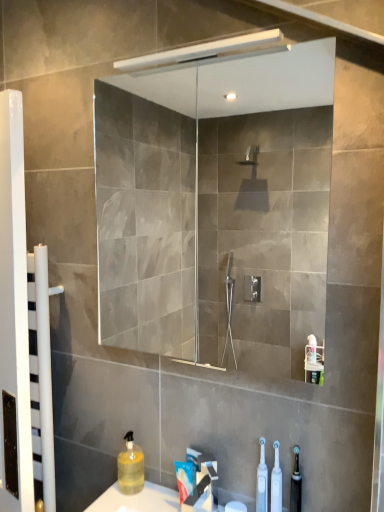
Question: Does transparent glass mirror at upper center have a larger size compared to white glossy towel rack at left?

Choices:
 (A) yes
 (B) no

Answer: (A)

Question: Can you confirm if transparent glass mirror at upper center is wider than white glossy towel rack at left?

Choices:
 (A) yes
 (B) no

Answer: (A)

Question: Is transparent glass mirror at upper center next to white glossy towel rack at left?

Choices:
 (A) yes
 (B) no

Answer: (B)

Question: Is transparent glass mirror at upper center positioned far away from white glossy towel rack at left?

Choices:
 (A) yes
 (B) no

Answer: (A)

Question: Can you confirm if transparent glass mirror at upper center is smaller than white glossy towel rack at left?

Choices:
 (A) yes
 (B) no

Answer: (B)

Question: Is point (296, 478) positioned closer to the camera than point (1, 507)?

Choices:
 (A) closer
 (B) farther

Answer: (A)

Question: Considering the positions of translucent plastic toothbrush at lower right, positioned as the first toiletry in right-to-left order, and white glossy towel rack at left in the image, is translucent plastic toothbrush at lower right, positioned as the first toiletry in right-to-left order, wider or thinner than white glossy towel rack at left?

Choices:
 (A) wide
 (B) thin

Answer: (B)

Question: From a real-world perspective, is translucent plastic toothbrush at lower right, acting as the second toiletry starting from the left, above or below white glossy towel rack at left?

Choices:
 (A) above
 (B) below

Answer: (B)

Question: From their relative heights in the image, would you say translucent plastic toothbrush at lower right, acting as the second toiletry starting from the left, is taller or shorter than white glossy towel rack at left?

Choices:
 (A) tall
 (B) short

Answer: (B)

Question: Is translucent yellow liquid at lower left, the first cleaning product in the back-to-front sequence, in front of or behind white plastic toothbrushes at lower center, placed as the second toiletry when sorted from right to left, in the image?

Choices:
 (A) behind
 (B) front

Answer: (A)

Question: From a real-world perspective, relative to white plastic toothbrushes at lower center, acting as the first toiletry starting from the left, is translucent yellow liquid at lower left, marked as the 1th cleaning product in a left-to-right arrangement, vertically above or below?

Choices:
 (A) above
 (B) below

Answer: (B)

Question: Is translucent yellow liquid at lower left, which appears as the second cleaning product when viewed from the front, bigger or smaller than white plastic toothbrushes at lower center, acting as the first toiletry starting from the left?

Choices:
 (A) big
 (B) small

Answer: (A)

Question: Is point (142, 461) closer or farther from the camera than point (261, 507)?

Choices:
 (A) closer
 (B) farther

Answer: (B)

Question: Based on their positions, is white glossy towel rack at left located to the left or right of white plastic toothbrush at lower center, which is the 1th cleaning product from front to back?

Choices:
 (A) right
 (B) left

Answer: (B)

Question: Is point (11, 154) closer or farther from the camera than point (278, 500)?

Choices:
 (A) farther
 (B) closer

Answer: (B)